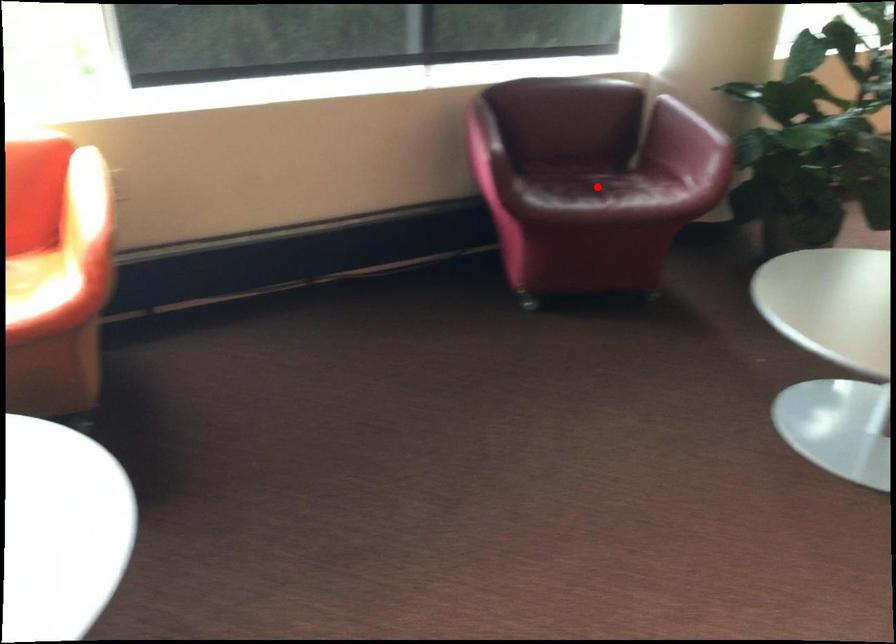
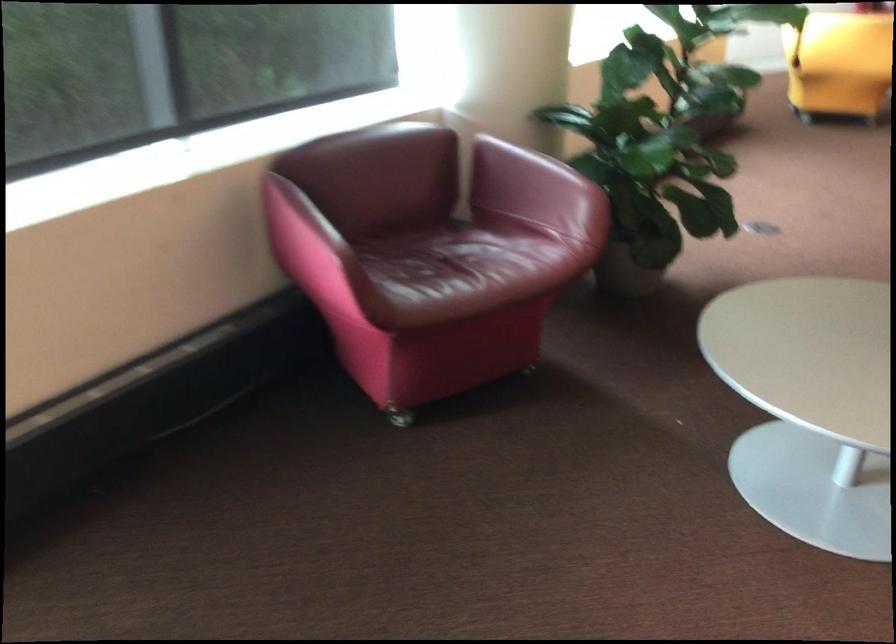
Question: I am providing you with two images of the same scene from different viewpoints. Image1 has a red point marked. In image2, the corresponding 3D location appears at what relative position? Reply with the corresponding letter.

Choices:
 (A) Closer
 (B) Farther

Answer: (A)